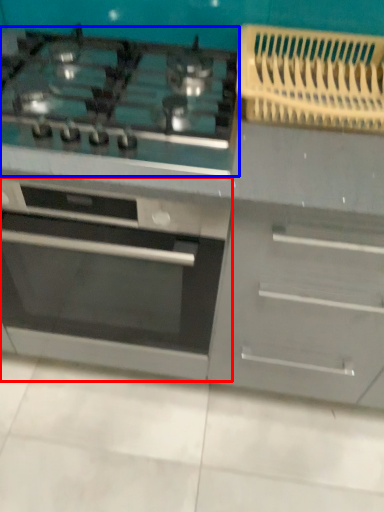
Question: Which object appears farthest to the camera in this image, oven (highlighted by a red box) or gas stove (highlighted by a blue box)?

Choices:
 (A) oven
 (B) gas stove

Answer: (A)